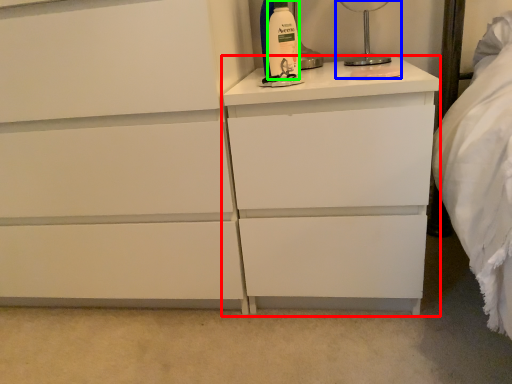
Question: Which object is the farthest from nightstand (highlighted by a red box)? Choose among these: bedside lamp (highlighted by a blue box) or cleaning product (highlighted by a green box).

Choices:
 (A) bedside lamp
 (B) cleaning product

Answer: (A)